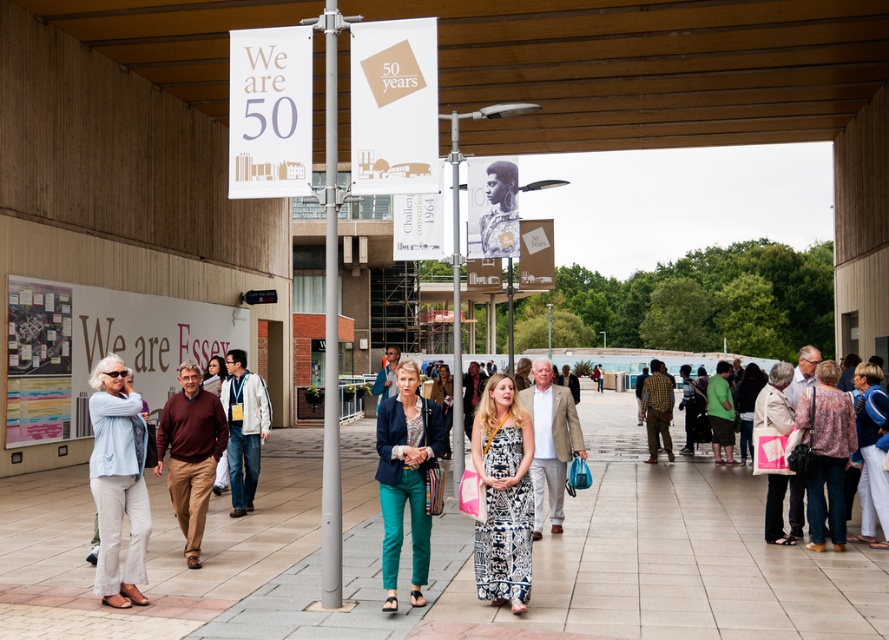
Question: Does maroon sweater at center appear on the right side of blue denim jacket at lower right?

Choices:
 (A) yes
 (B) no

Answer: (B)

Question: Observing the image, what is the correct spatial positioning of white paper banner at upper left in reference to light blue denim jacket at lower left?

Choices:
 (A) below
 (B) above

Answer: (B)

Question: Estimate the real-world distances between objects in this image. Which object is farther from the maroon sweater at center?

Choices:
 (A) silver metallic pole at center
 (B) white paper banner at upper left
 (C) patterned fabric crowd at center

Answer: (C)

Question: Estimate the real-world distances between objects in this image. Which object is farther from the white paper banner at upper left?

Choices:
 (A) teal fabric pants at center
 (B) light blue denim jacket at lower left
 (C) blue denim jacket at lower right
 (D) maroon sweater at center

Answer: (C)

Question: Which of these objects is positioned farthest from the smooth concrete pavement at center?

Choices:
 (A) light blue denim jacket at lower left
 (B) maroon sweater at center

Answer: (A)

Question: Does patterned fabric crowd at center appear over beige fabric handbag at lower right?

Choices:
 (A) yes
 (B) no

Answer: (B)